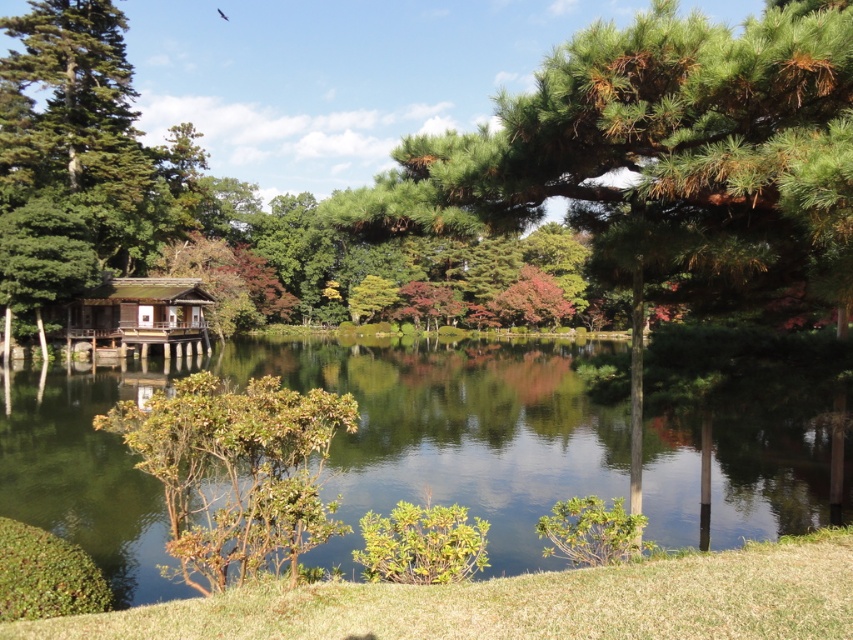
Question: Estimate the real-world distances between objects in this image. Which object is farther from the green leafy bush at center?

Choices:
 (A) green needle-like pine tree at center
 (B) wooden hut at center
 (C) green glossy water at center

Answer: (B)

Question: Can you confirm if green glossy water at center is positioned below wooden hut at center?

Choices:
 (A) yes
 (B) no

Answer: (A)

Question: Which object is positioned closest to the wooden hut at center?

Choices:
 (A) green leafy bush at center
 (B) green glossy water at center
 (C) green needle-like pine tree at center

Answer: (B)

Question: Does green glossy water at center appear under wooden hut at center?

Choices:
 (A) no
 (B) yes

Answer: (B)

Question: Does green glossy water at center appear on the left side of green needle-like pine tree at center?

Choices:
 (A) yes
 (B) no

Answer: (A)

Question: Which point is closer to the camera?

Choices:
 (A) green glossy water at center
 (B) wooden hut at center
 (C) green leafy bush at center

Answer: (C)